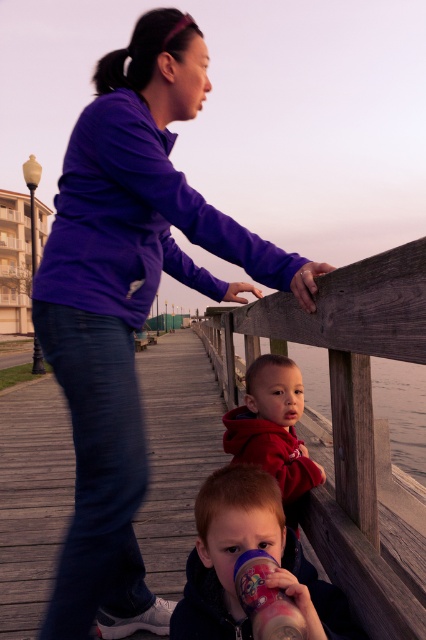
Question: Can you confirm if dark blue fleece jacket at lower center is bigger than matte plastic sippy cup at lower center?

Choices:
 (A) no
 (B) yes

Answer: (B)

Question: Is the position of red fleece jacket at center less distant than that of matte plastic sippy cup at lower center?

Choices:
 (A) no
 (B) yes

Answer: (A)

Question: Which of these objects is positioned farthest from the purple fleece jacket at upper center?

Choices:
 (A) dark blue fleece jacket at lower center
 (B) matte plastic sippy cup at lower center

Answer: (B)

Question: Which of these objects is positioned closest to the purple fleece jacket at upper center?

Choices:
 (A) transparent water at rail center
 (B) dark blue fleece jacket at lower center
 (C) matte plastic sippy cup at lower center

Answer: (B)

Question: Is red fleece jacket at center positioned in front of matte plastic sippy cup at lower center?

Choices:
 (A) no
 (B) yes

Answer: (A)

Question: Among these points, which one is nearest to the camera?

Choices:
 (A) (195, 582)
 (B) (299, 378)
 (C) (399, 397)
 (D) (72, 410)

Answer: (A)